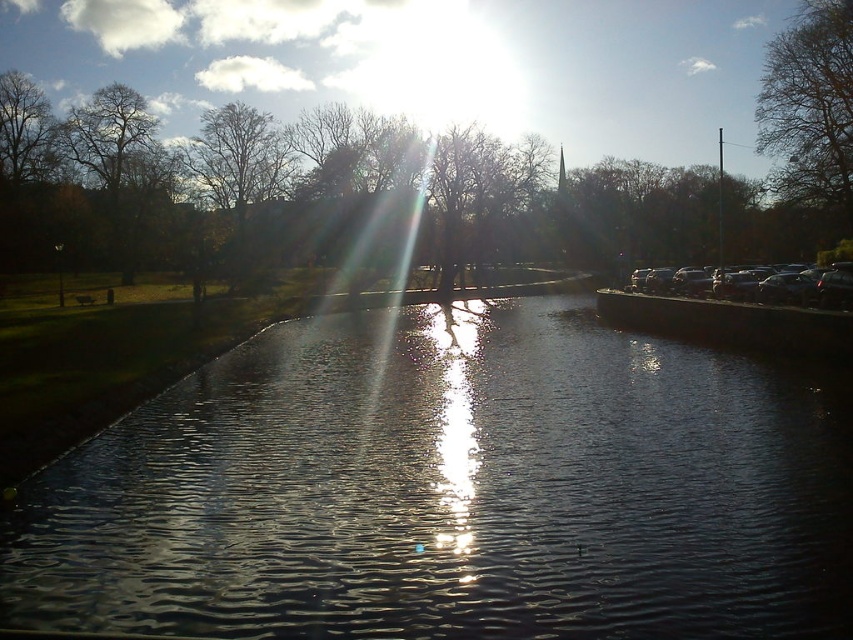
Question: Which of the following is the farthest from the observer?

Choices:
 (A) (827, 60)
 (B) (578, 333)

Answer: (A)

Question: Can you confirm if shiny dark water at center is smaller than brown leafless tree at upper left?

Choices:
 (A) no
 (B) yes

Answer: (B)

Question: Which point appears closest to the camera in this image?

Choices:
 (A) (839, 54)
 (B) (132, 129)

Answer: (A)

Question: Which point is closer to the camera?

Choices:
 (A) shiny dark water at center
 (B) brown leafless tree at upper left
 (C) brown leafless tree at upper right

Answer: (A)

Question: Does shiny dark water at center appear on the right side of brown leafless tree at upper left?

Choices:
 (A) yes
 (B) no

Answer: (A)

Question: Can you confirm if shiny dark water at center is positioned to the right of brown leafless tree at upper left?

Choices:
 (A) no
 (B) yes

Answer: (B)